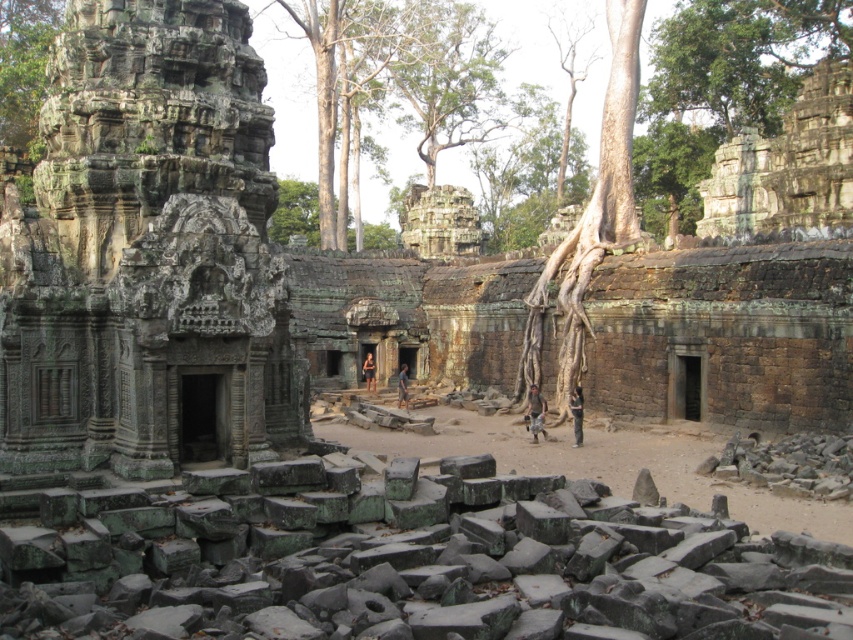
You are standing at the entrance of the ancient temple complex and see two points marked in the scene. The first point is at coordinates point (335, 506) and the second is at point (763, 145). Which point is closer to you?

The point at coordinates point (335, 506) is closer to you than the point at point (763, 145).

You are an archaeologist working at the temple complex. You need to document the location of the green stone wall at upper right. What are its coordinates?

The green stone wall at upper right is located at coordinates point (787, 164).